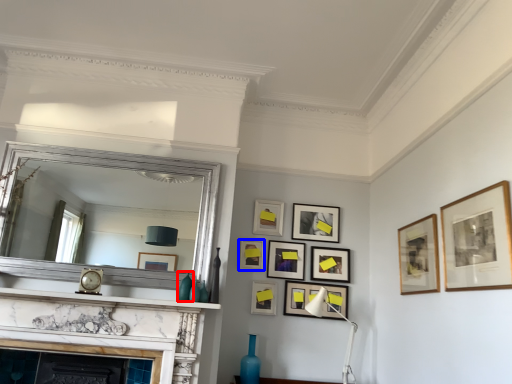
Question: Which point is further to the camera, vase (highlighted by a red box) or picture frame (highlighted by a blue box)?

Choices:
 (A) vase
 (B) picture frame

Answer: (B)